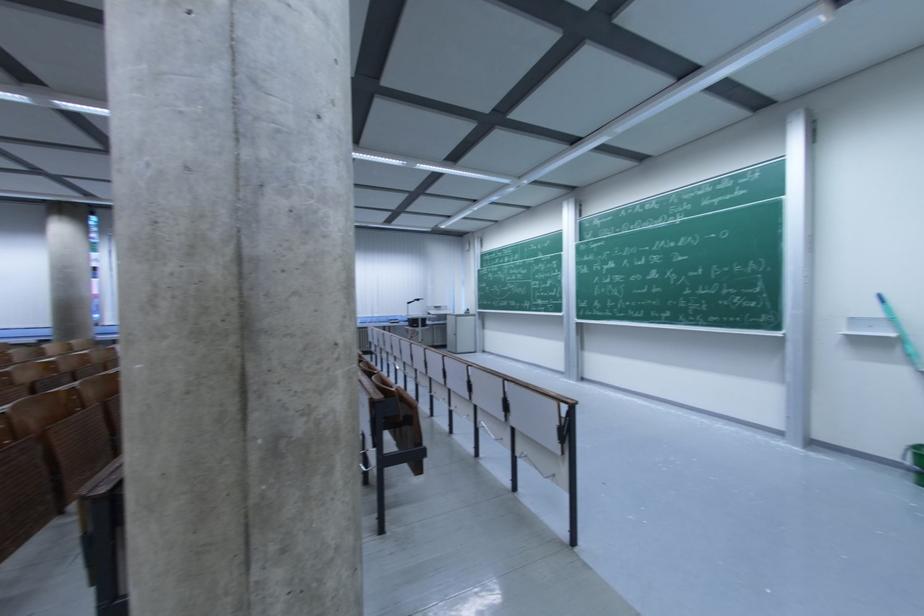
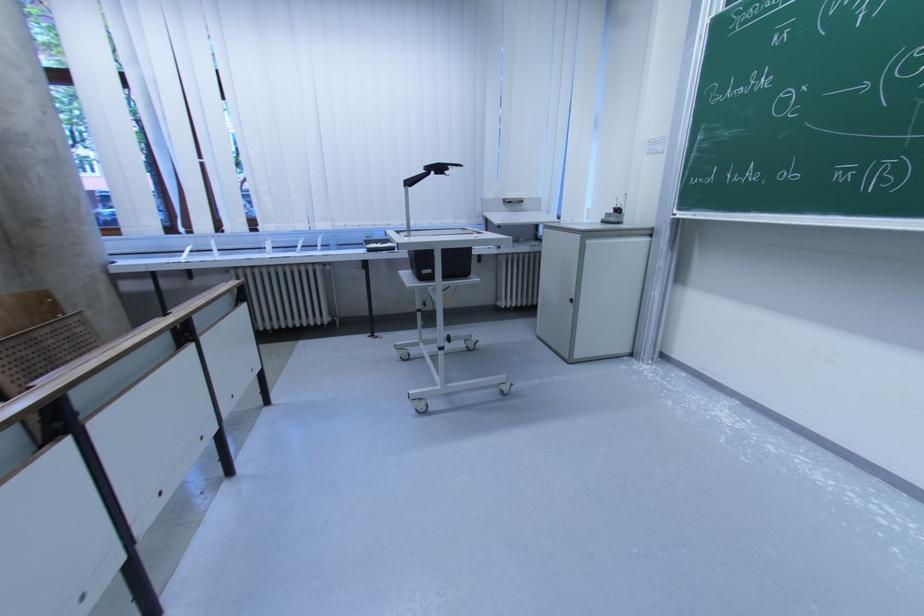
The point at (412, 305) is marked in the first image. Where is the corresponding point in the second image?

(415, 185)